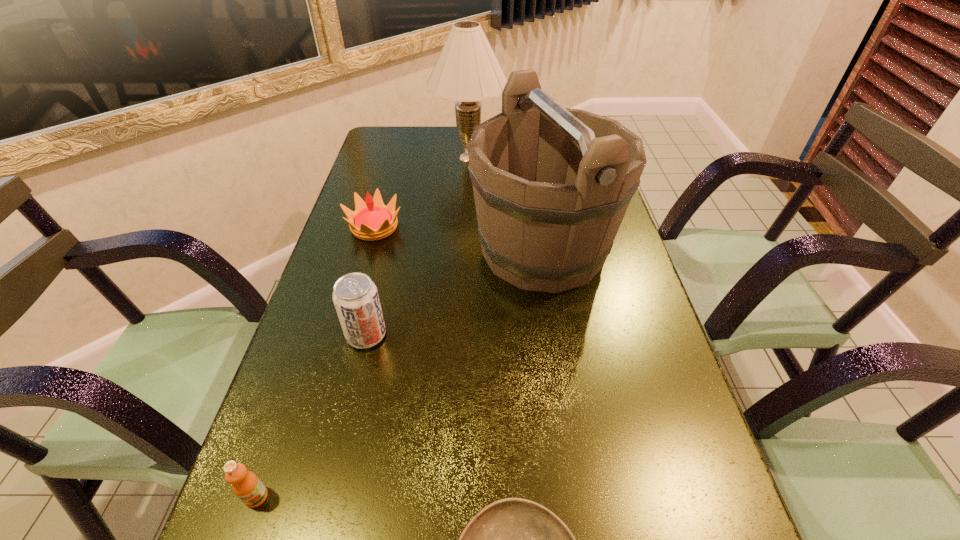
Locate an element on the screen. The height and width of the screenshot is (540, 960). object that is at the far edge is located at coordinates (467, 70).

You are a GUI agent. You are given a task and a screenshot of the screen. Output one action in this format:
    pyautogui.click(x=<x>, y=<y>)
    Task: Click on the soda can at the left edge
    
    Given the screenshot: What is the action you would take?
    [x=355, y=296]

Identify the location of crown located in the left edge section of the desktop. (372, 220).

You are a GUI agent. You are given a task and a screenshot of the screen. Output one action in this format:
    pyautogui.click(x=<x>, y=<y>)
    Task: Click on the orange juice present at the left edge
    The image size is (960, 540).
    Given the screenshot: What is the action you would take?
    pyautogui.click(x=246, y=485)

Where is `object present at the right edge`? The width and height of the screenshot is (960, 540). object present at the right edge is located at coordinates (x=551, y=185).

Locate an element on the screen. This screenshot has height=540, width=960. vacant space at the far edge of the desktop is located at coordinates pos(460,154).

At what (x,y) coordinates should I click in order to perform the action: click on vacant space at the left edge of the desktop. Please return your answer as a coordinate pair (x, y). The height and width of the screenshot is (540, 960). Looking at the image, I should click on (325, 306).

Image resolution: width=960 pixels, height=540 pixels. In the image, there is a desktop. Identify the location of blank space at the right edge. (639, 391).

Find the location of a particular element. The width and height of the screenshot is (960, 540). vacant area between the bucket and the fifth farthest object is located at coordinates (399, 373).

This screenshot has height=540, width=960. Identify the location of empty location between the crown and the bucket. (459, 239).